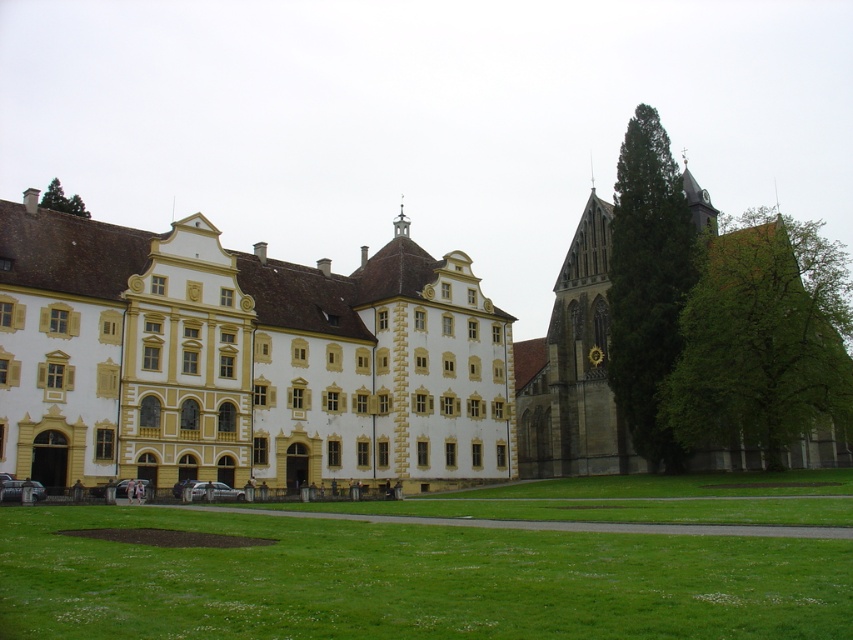
Question: Which point is closer to the camera?

Choices:
 (A) (763, 371)
 (B) (86, 211)
 (C) (747, 595)

Answer: (C)

Question: Can you confirm if green grass at lower center is positioned to the left of green leafy tree at right?

Choices:
 (A) yes
 (B) no

Answer: (A)

Question: Is yellow stone church at center to the left of green grass at lower center from the viewer's perspective?

Choices:
 (A) no
 (B) yes

Answer: (B)

Question: Does green grass at lower center have a greater width compared to green leafy tree at right?

Choices:
 (A) yes
 (B) no

Answer: (B)

Question: Among these objects, which one is farthest from the camera?

Choices:
 (A) green leafy tree at upper left
 (B) green textured tree at right

Answer: (A)

Question: Which point is closer to the camera taking this photo?

Choices:
 (A) (474, 324)
 (B) (712, 381)

Answer: (B)